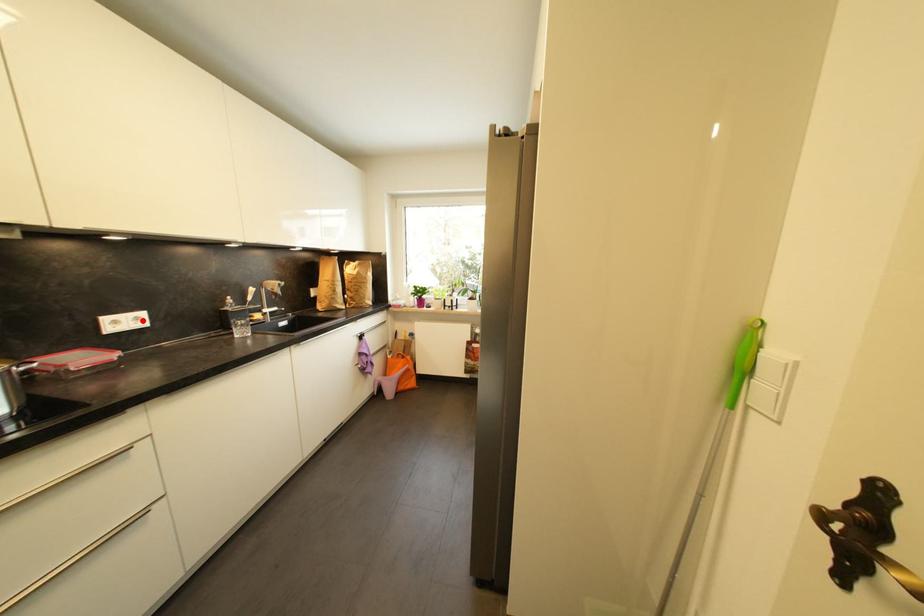
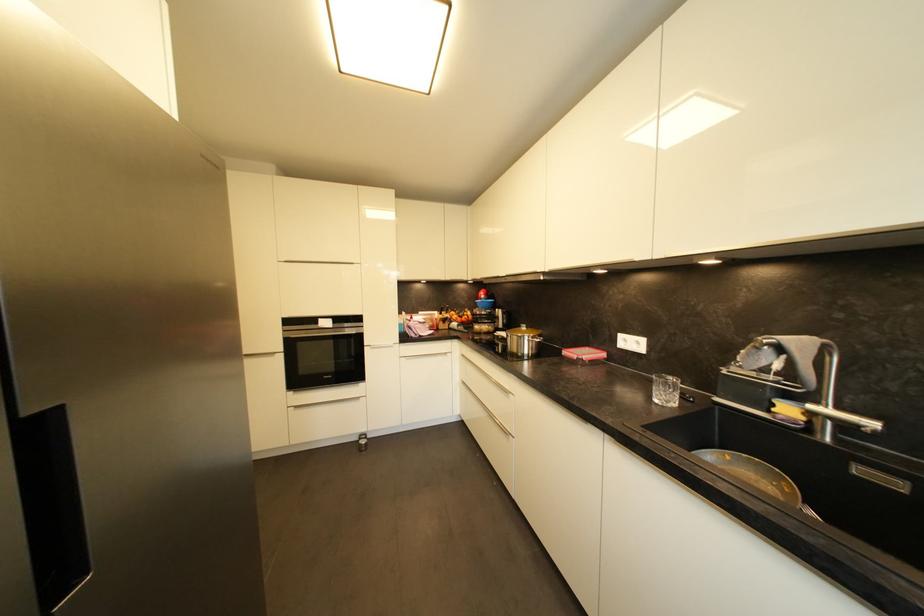
Where in the second image is the point corresponding to the highlighted location from the first image?

(642, 345)